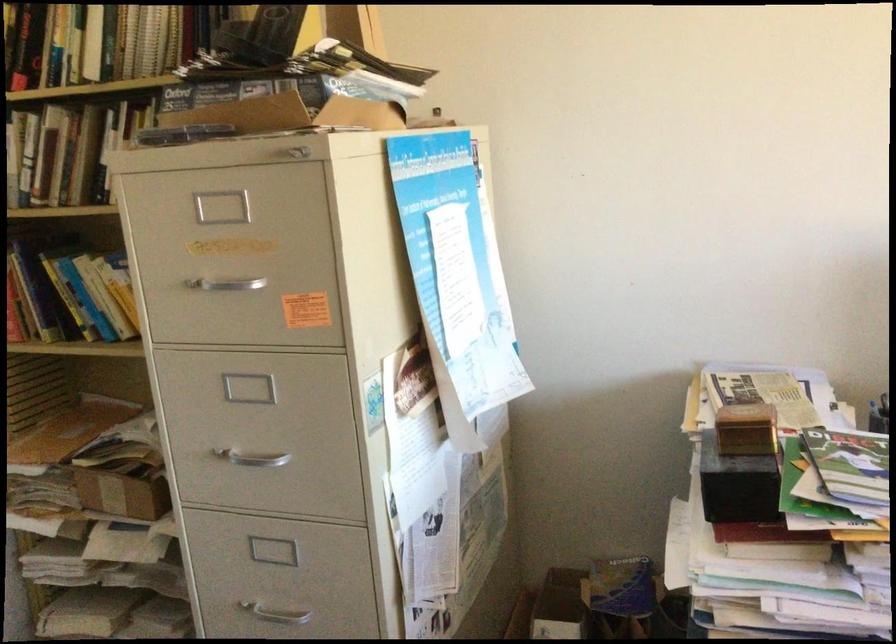
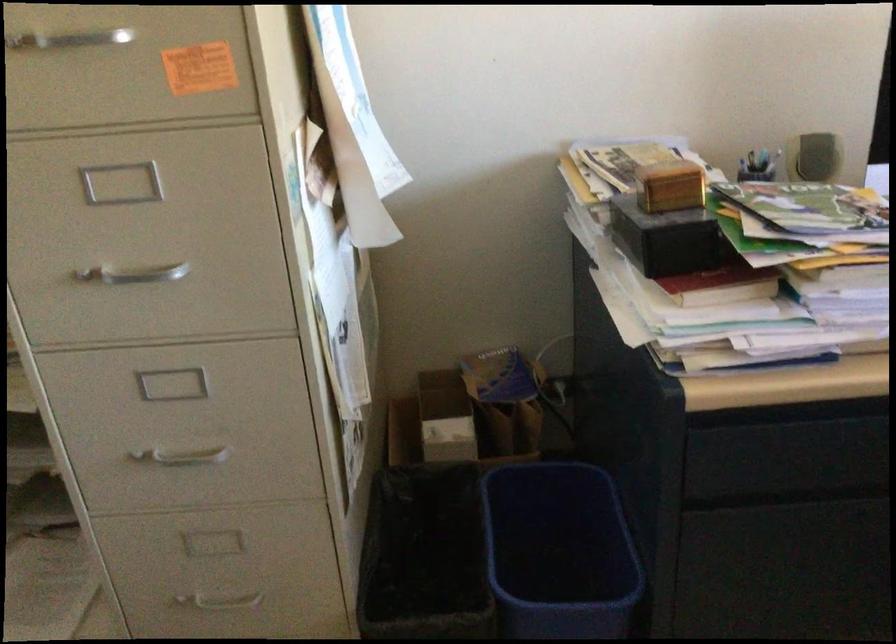
What movement of the cameraman would produce the second image?

The cameraman walked toward left, forward.